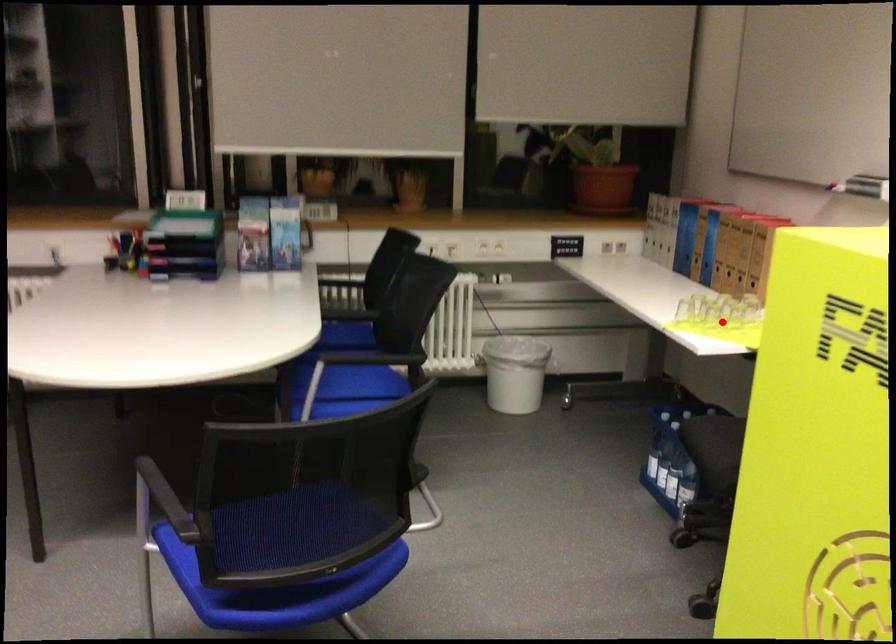
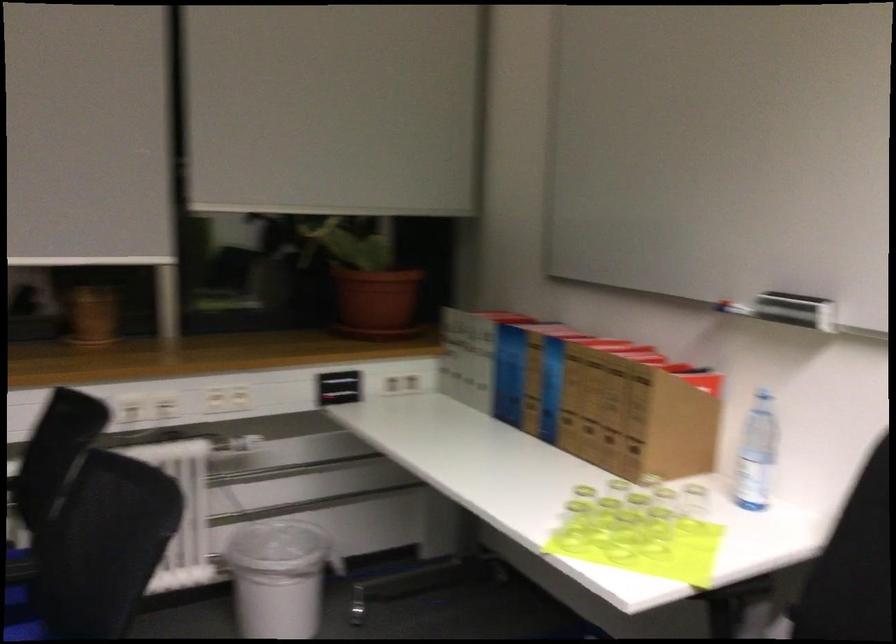
Where in the second image is the point corresponding to the highlighted location from the first image?

(623, 536)